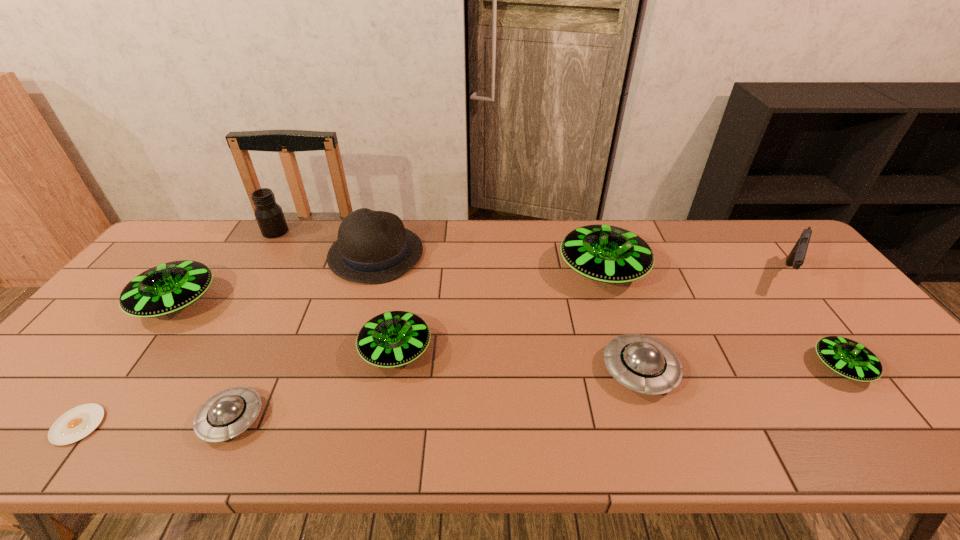
The image size is (960, 540). Find the location of `vacant region at the right edge`. vacant region at the right edge is located at coordinates (835, 328).

Find the location of a particular element. The width and height of the screenshot is (960, 540). free area in between the third object from left to right and the leftmost saucer is located at coordinates click(226, 267).

You are a GUI agent. You are given a task and a screenshot of the screen. Output one action in this format:
    pyautogui.click(x=<x>, y=<y>)
    Task: Click on the free space between the gun and the fifth saucer from right to left
    This screenshot has height=540, width=960.
    Given the screenshot: What is the action you would take?
    pyautogui.click(x=509, y=347)

Find the location of a particular element. The image size is (960, 540). unoccupied area between the rightmost saucer and the biggest green saucer is located at coordinates (722, 319).

Where is `free point between the rightmost saucer and the biggest green saucer`? free point between the rightmost saucer and the biggest green saucer is located at coordinates (722, 319).

Locate an element on the screen. free spot between the jar and the gun is located at coordinates (531, 253).

Find the location of a particular element. The height and width of the screenshot is (540, 960). unoccupied area between the left gray saucer and the leftmost green saucer is located at coordinates (204, 361).

Find the location of `vacant area between the egg yolk and the right gray saucer`. vacant area between the egg yolk and the right gray saucer is located at coordinates (359, 397).

This screenshot has width=960, height=540. I want to click on blank region between the right gray saucer and the shortest object, so click(x=359, y=397).

This screenshot has height=540, width=960. I want to click on free space between the leftmost green saucer and the jar, so click(226, 267).